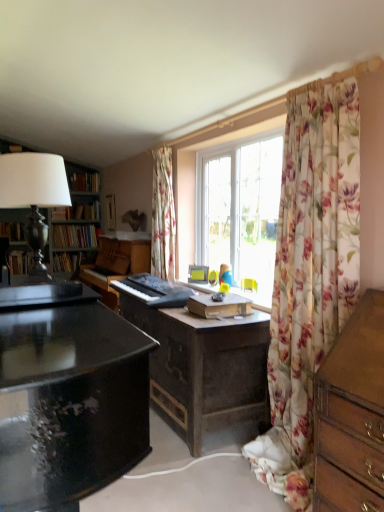
Question: Is black matte keyboard at center inside the boundaries of matte yellow picture frame at center, the 1th picture frame positioned from the right, or outside?

Choices:
 (A) outside
 (B) inside

Answer: (A)

Question: From a real-world perspective, is black matte keyboard at center positioned above or below matte yellow picture frame at center, placed as the 1th picture frame when sorted from bottom to top?

Choices:
 (A) below
 (B) above

Answer: (A)

Question: Estimate the real-world distances between objects in this image. Which object is closer to the hardcover book at left, marked as the 1th book in a top-to-bottom arrangement?

Choices:
 (A) matte yellow picture frame at center, the second picture frame when ordered from back to front
 (B) floral fabric curtain at center, arranged as the 1th curtain when viewed from the left
 (C) wooden picture frame at center, the 2th picture frame positioned from the bottom
 (D) dark wood bookcase at left
 (E) black matte keyboard at center

Answer: (C)

Question: Which is nearer to the matte yellow picture frame at center, which is the 1th picture frame in front-to-back order?

Choices:
 (A) floral sheer curtain at right, positioned as the 2th curtain in back-to-front order
 (B) floral fabric curtain at center, which is the 1th curtain in back-to-front order
 (C) wooden picture frame at center, placed as the first picture frame when sorted from top to bottom
 (D) black matte keyboard at center
 (E) hardcover book at left, which is the fourth book in top-to-bottom order

Answer: (B)